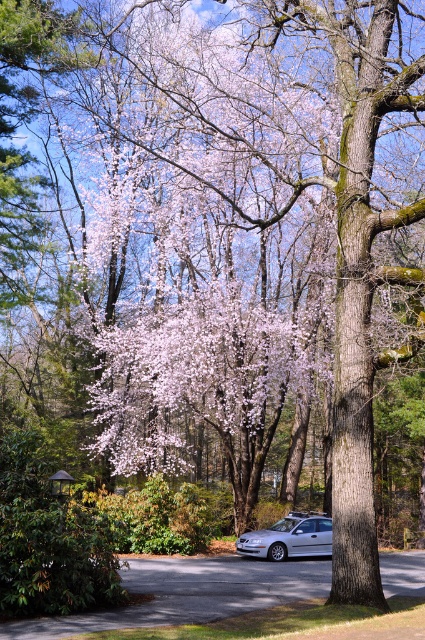
Question: Among these objects, which one is farthest from the camera?

Choices:
 (A) silver metallic car at lower center
 (B) gray asphalt driveway at lower center

Answer: (A)

Question: Can you confirm if gray asphalt driveway at lower center is positioned above silver metallic car at lower center?

Choices:
 (A) no
 (B) yes

Answer: (B)

Question: Does gray asphalt driveway at lower center lie behind silver metallic car at lower center?

Choices:
 (A) no
 (B) yes

Answer: (A)

Question: Can you confirm if gray asphalt driveway at lower center is positioned to the left of silver metallic car at lower center?

Choices:
 (A) no
 (B) yes

Answer: (B)

Question: Among these points, which one is farthest from the camera?

Choices:
 (A) (197, 621)
 (B) (317, 552)

Answer: (B)